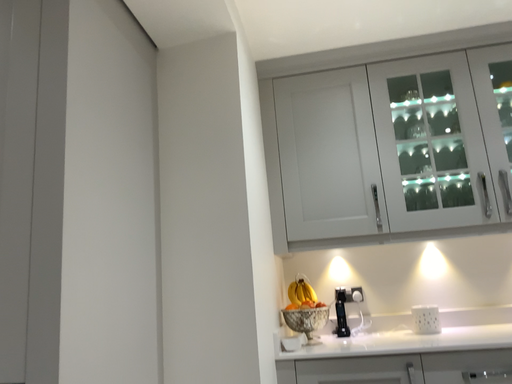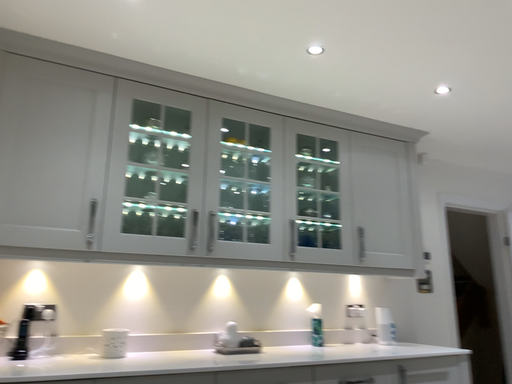
Question: How did the camera likely rotate when shooting the video?

Choices:
 (A) rotated right
 (B) rotated left

Answer: (A)